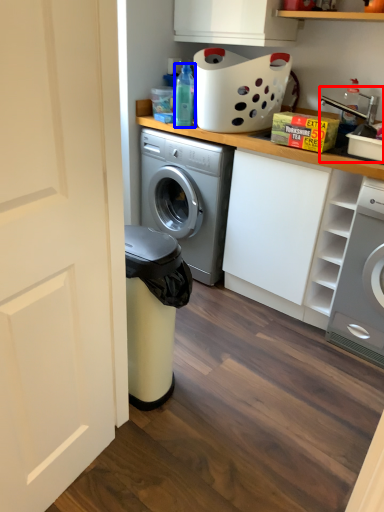
Question: Which of the following is the farthest to the observer, sink (highlighted by a red box) or bottle (highlighted by a blue box)?

Choices:
 (A) sink
 (B) bottle

Answer: (B)